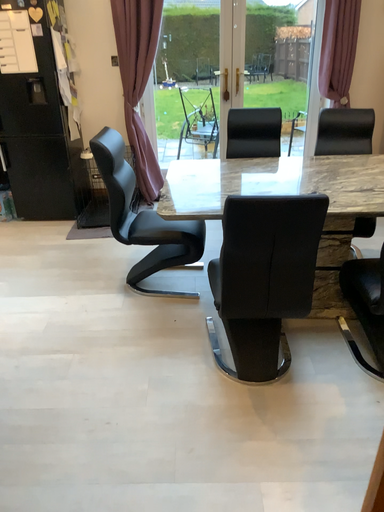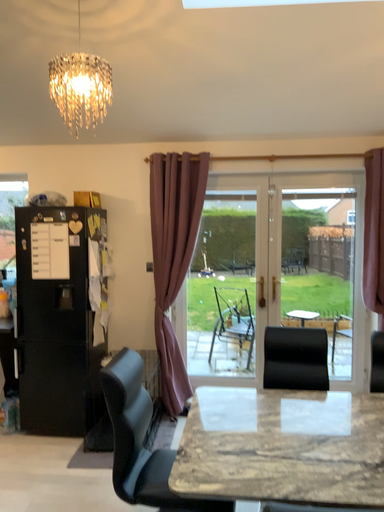
Question: How did the camera likely rotate when shooting the video?

Choices:
 (A) rotated upward
 (B) rotated downward

Answer: (A)